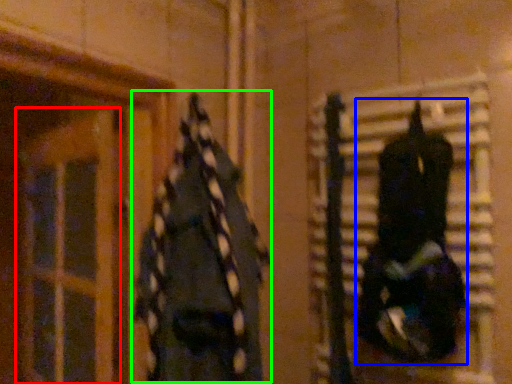
Question: Based on their relative distances, which object is nearer to glass door (highlighted by a red box)? Choose from clothing (highlighted by a blue box) and clothing (highlighted by a green box).

Choices:
 (A) clothing
 (B) clothing

Answer: (B)